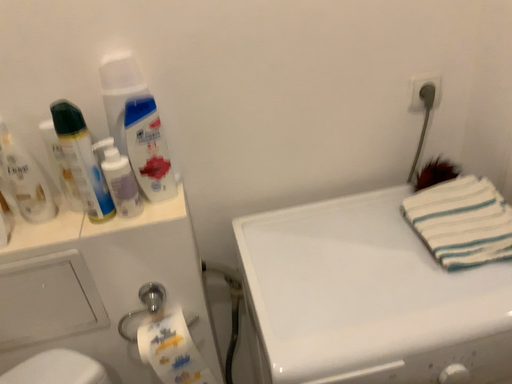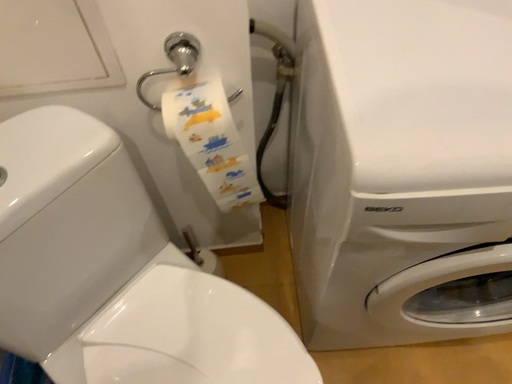
Question: Which way did the camera rotate in the video?

Choices:
 (A) rotated downward
 (B) rotated upward

Answer: (A)